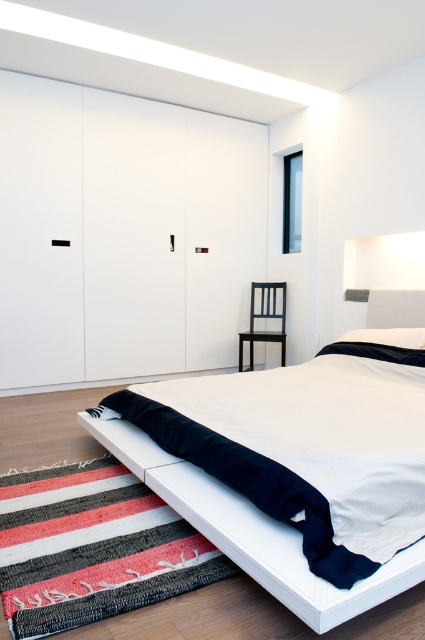
Based on the photo, is the position of white matte bed at center more distant than that of black matte chair at right?

No, it is not.

How distant is white matte bed at center from black matte chair at right?

A distance of 8.44 feet exists between white matte bed at center and black matte chair at right.

In order to click on white matte bed at center in this screenshot , I will do `click(252, 532)`.

Where is `white matte bed at center`? Image resolution: width=425 pixels, height=640 pixels. white matte bed at center is located at coordinates (252, 532).

Between white matte bed at center and white soft pillow at lower right, which one is positioned lower?

white matte bed at center is lower down.

Can you confirm if white matte bed at center is taller than white soft pillow at lower right?

Indeed, white matte bed at center has a greater height compared to white soft pillow at lower right.

Is point (384, 573) less distant than point (399, 346)?

That is True.

Locate an element on the screen. Image resolution: width=425 pixels, height=640 pixels. white matte bed at center is located at coordinates (252, 532).

Who is more forward, (251, 330) or (396, 346)?

Point (396, 346) is more forward.

Can you confirm if black matte chair at right is bigger than white soft pillow at lower right?

Yes.

Locate an element on the screen. Image resolution: width=425 pixels, height=640 pixels. black matte chair at right is located at coordinates (265, 317).

You are a GUI agent. You are given a task and a screenshot of the screen. Output one action in this format:
    pyautogui.click(x=<x>, y=<y>)
    Task: Click on the black matte chair at right
    The image size is (425, 640).
    Given the screenshot: What is the action you would take?
    pyautogui.click(x=265, y=317)